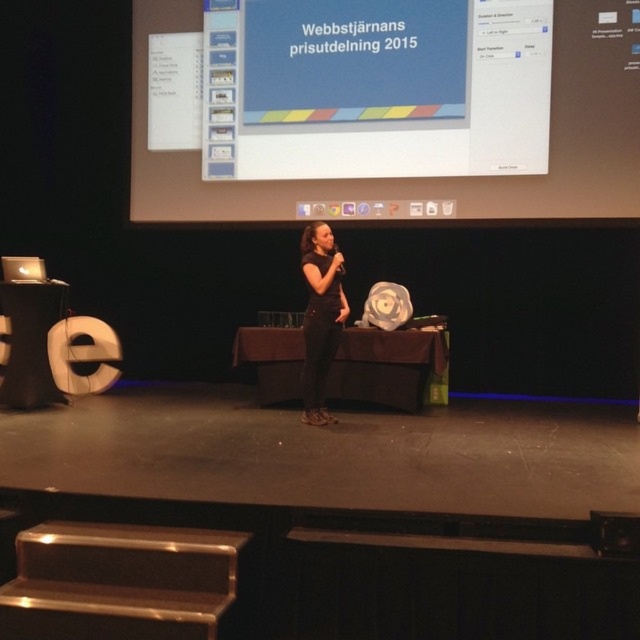
Is white glossy projection screen at upper center wider than black matte dress at center?

Correct, the width of white glossy projection screen at upper center exceeds that of black matte dress at center.

Locate an element on the screen. white glossy projection screen at upper center is located at coordinates (426, 179).